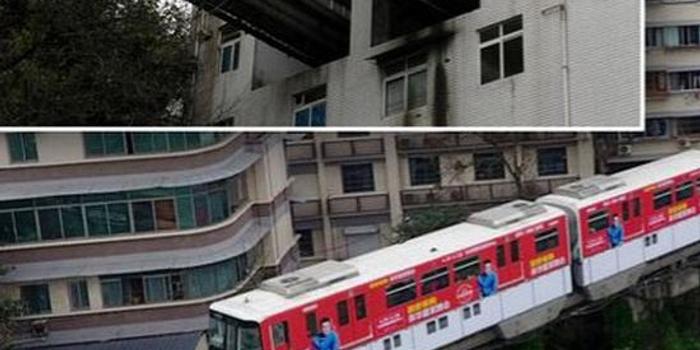
Identify the location of wall. The height and width of the screenshot is (350, 700). (582, 68).